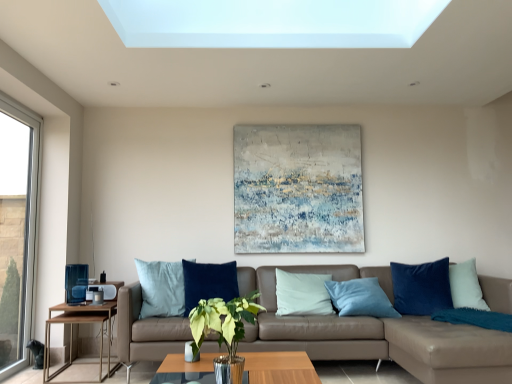
You are a GUI agent. You are given a task and a screenshot of the screen. Output one action in this format:
    pyautogui.click(x=<x>, y=<y>)
    Task: Click on the vacant space situated above textured canvas painting at center (from a real-world perspective)
    
    Given the screenshot: What is the action you would take?
    pyautogui.click(x=294, y=124)